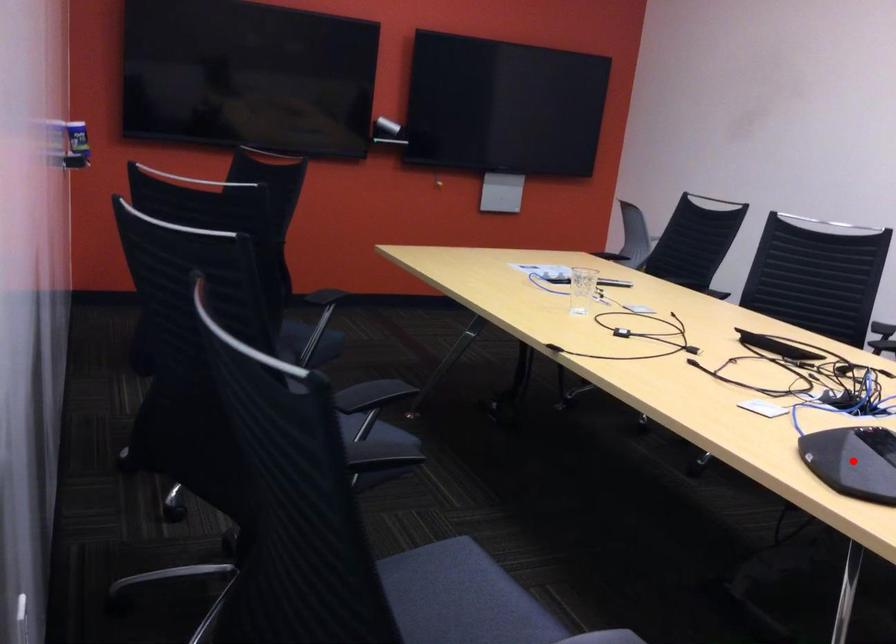
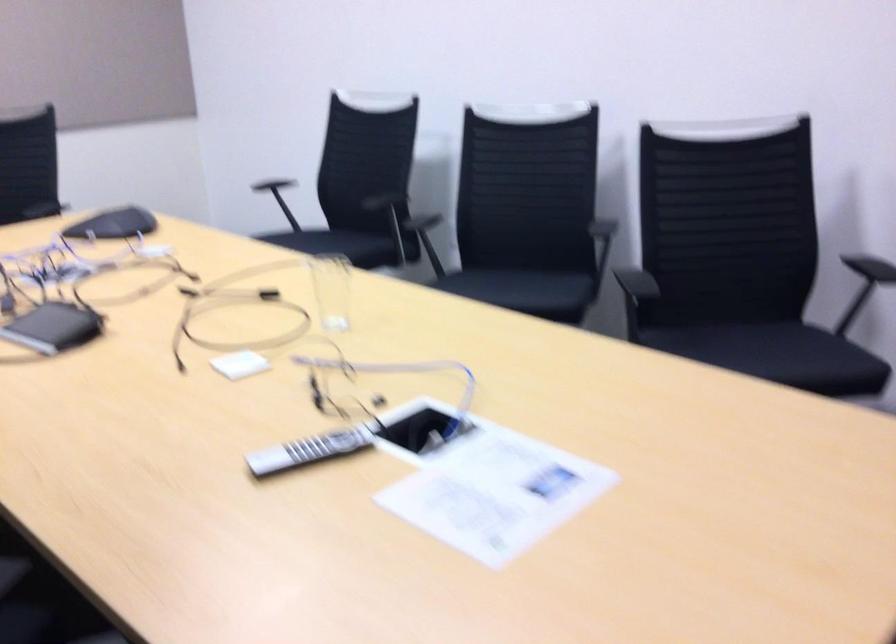
Question: I am providing you with two images of the same scene from different viewpoints. A red point is marked on the first image. Is the red point's position out of view in image 2?

Choices:
 (A) Yes
 (B) No

Answer: (A)